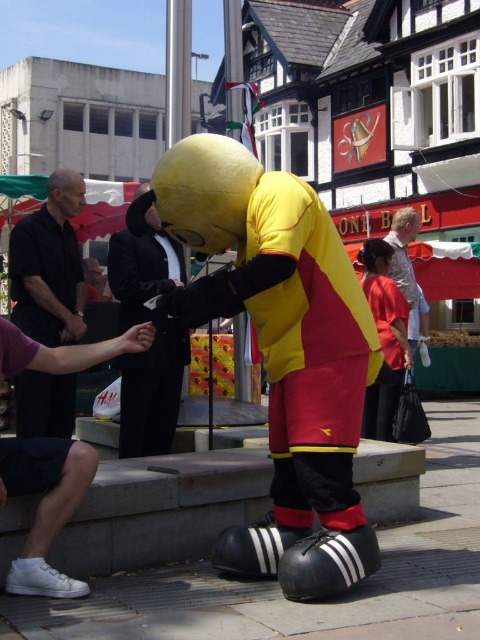
Question: Which object appears closest to the camera in this image?

Choices:
 (A) white matte sneakers at lower left
 (B) matte yellow costume at center
 (C) yellow plush mascot at center
 (D) black matte shirt at left

Answer: (A)

Question: Is black matte shirt at left to the left of matte yellow costume at center from the viewer's perspective?

Choices:
 (A) yes
 (B) no

Answer: (A)

Question: Can you confirm if white matte sneakers at lower left is positioned to the left of black suit at center?

Choices:
 (A) no
 (B) yes

Answer: (B)

Question: Estimate the real-world distances between objects in this image. Which object is farther from the yellow plush mascot at center?

Choices:
 (A) white matte sneakers at lower left
 (B) matte yellow costume at center

Answer: (B)

Question: Does white matte sneakers at lower left appear over matte yellow costume at center?

Choices:
 (A) no
 (B) yes

Answer: (A)

Question: Among these points, which one is nearest to the camera?

Choices:
 (A) (384, 388)
 (B) (124, 326)
 (C) (35, 310)

Answer: (B)